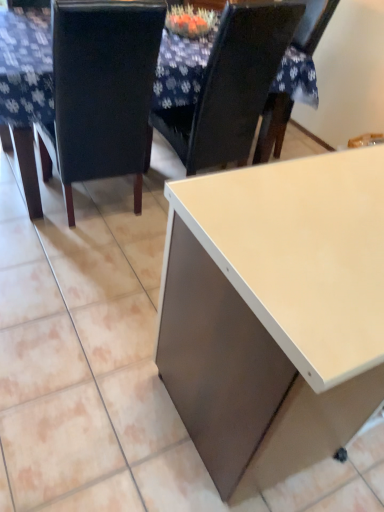
Question: Does matte black chair at upper center, acting as the 1th chair starting from the right, have a greater width compared to white glossy table at center?

Choices:
 (A) yes
 (B) no

Answer: (B)

Question: Is matte black chair at upper center, acting as the 1th chair starting from the right, not near white glossy table at center?

Choices:
 (A) no
 (B) yes

Answer: (A)

Question: From the image's perspective, is matte black chair at upper center, positioned as the second chair in left-to-right order, located beneath white glossy table at center?

Choices:
 (A) no
 (B) yes

Answer: (B)

Question: Is matte black chair at upper center, positioned as the second chair in left-to-right order, bigger than white glossy table at center?

Choices:
 (A) yes
 (B) no

Answer: (B)

Question: Does matte black chair at upper center, positioned as the second chair in left-to-right order, lie in front of white glossy table at center?

Choices:
 (A) yes
 (B) no

Answer: (B)

Question: From a real-world perspective, is matte black chair at upper center, acting as the 1th chair starting from the right, positioned under white glossy table at center based on gravity?

Choices:
 (A) no
 (B) yes

Answer: (A)

Question: From the image's perspective, is black leather chair at left, which appears as the second chair when viewed from the right, over matte black chair at upper center, acting as the 1th chair starting from the right?

Choices:
 (A) no
 (B) yes

Answer: (A)

Question: From a real-world perspective, is black leather chair at left, the 1th chair in the left-to-right sequence, over matte black chair at upper center, positioned as the second chair in left-to-right order?

Choices:
 (A) yes
 (B) no

Answer: (B)

Question: Is black leather chair at left, which appears as the second chair when viewed from the right, oriented away from matte black chair at upper center, acting as the 1th chair starting from the right?

Choices:
 (A) yes
 (B) no

Answer: (B)

Question: Is black leather chair at left, which appears as the second chair when viewed from the right, aimed at matte black chair at upper center, acting as the 1th chair starting from the right?

Choices:
 (A) no
 (B) yes

Answer: (A)

Question: Is black leather chair at left, the 1th chair in the left-to-right sequence, behind matte black chair at upper center, positioned as the second chair in left-to-right order?

Choices:
 (A) yes
 (B) no

Answer: (B)

Question: Is black leather chair at left, which appears as the second chair when viewed from the right, at the left side of matte black chair at upper center, acting as the 1th chair starting from the right?

Choices:
 (A) yes
 (B) no

Answer: (A)

Question: Does white glossy table at center have a greater width compared to matte black chair at upper center, positioned as the second chair in left-to-right order?

Choices:
 (A) yes
 (B) no

Answer: (A)